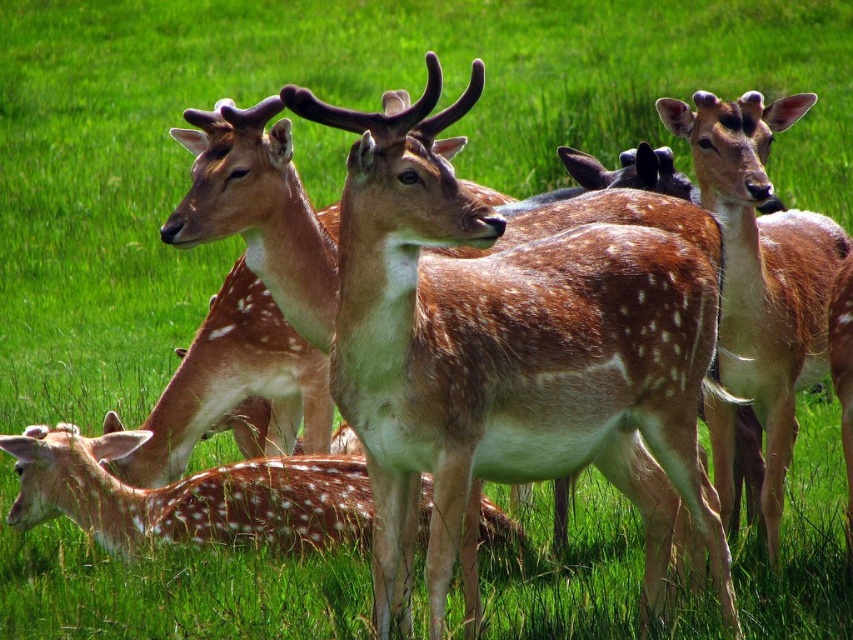
Question: From the image, what is the correct spatial relationship of brown spotted fur at center in relation to spotted fur deer at center?

Choices:
 (A) right
 (B) left

Answer: (A)

Question: Estimate the real-world distances between objects in this image. Which object is farther from the brown spotted fur at center?

Choices:
 (A) brown speckled fur at center
 (B) spotted fur deer at center

Answer: (B)

Question: Is brown speckled fur at center behind brown spotted fur at center?

Choices:
 (A) yes
 (B) no

Answer: (B)

Question: Based on their relative distances, which object is nearer to the brown speckled fur at center?

Choices:
 (A) brown spotted fur at center
 (B) spotted fur deer at center

Answer: (A)

Question: Which point is closer to the camera taking this photo?

Choices:
 (A) (399, 163)
 (B) (26, 444)

Answer: (A)

Question: Can you confirm if brown spotted fur at center is positioned to the right of spotted fur deer at center?

Choices:
 (A) no
 (B) yes

Answer: (B)